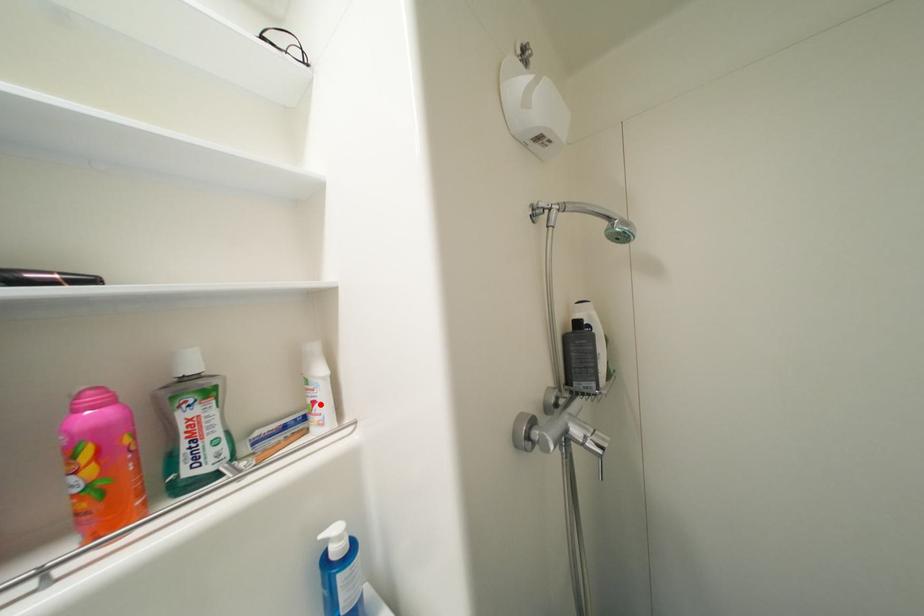
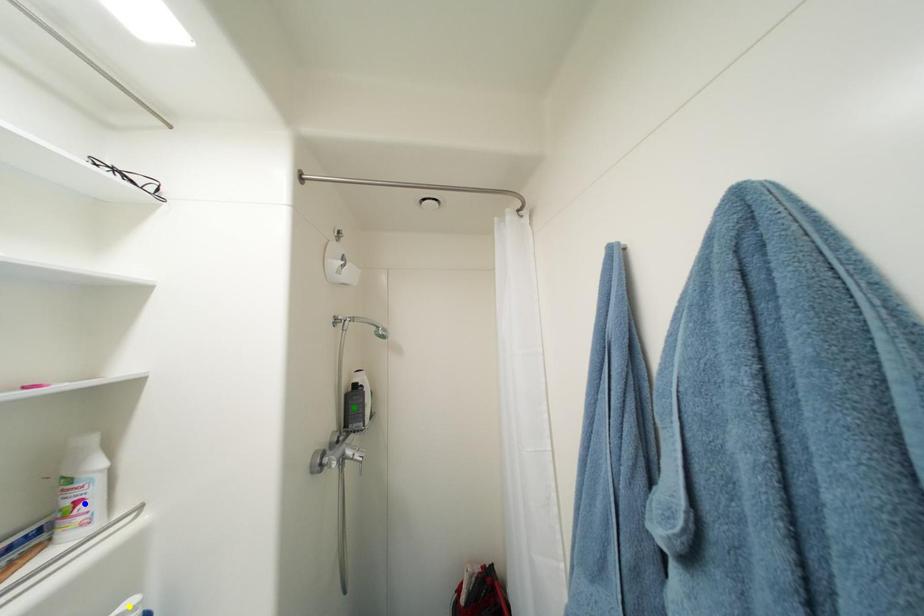
Question: I am providing you with two images of the same scene from different viewpoints. A red point is marked on the first image. You are given multiple points on the second image. In image 2, which mark is for the same physical point as the one in image 1?

Choices:
 (A) blue point
 (B) yellow point
 (C) green point

Answer: (A)